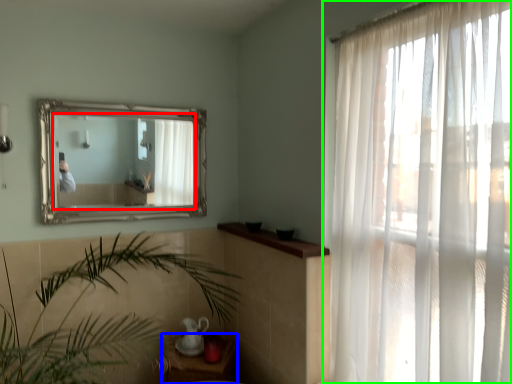
Question: Considering the real-world distances, which object is closest to mirror (highlighted by a red box)? table (highlighted by a blue box) or curtain (highlighted by a green box).

Choices:
 (A) table
 (B) curtain

Answer: (A)